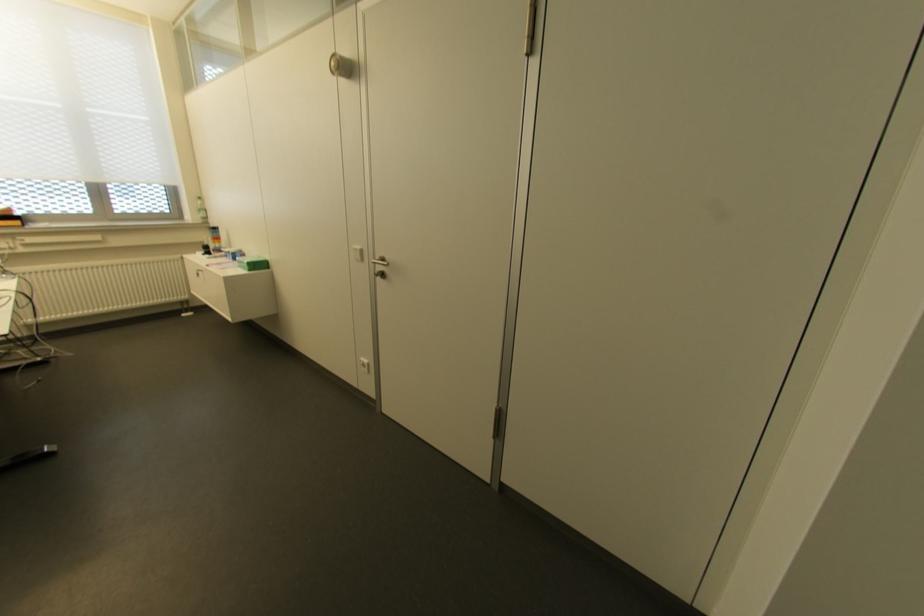
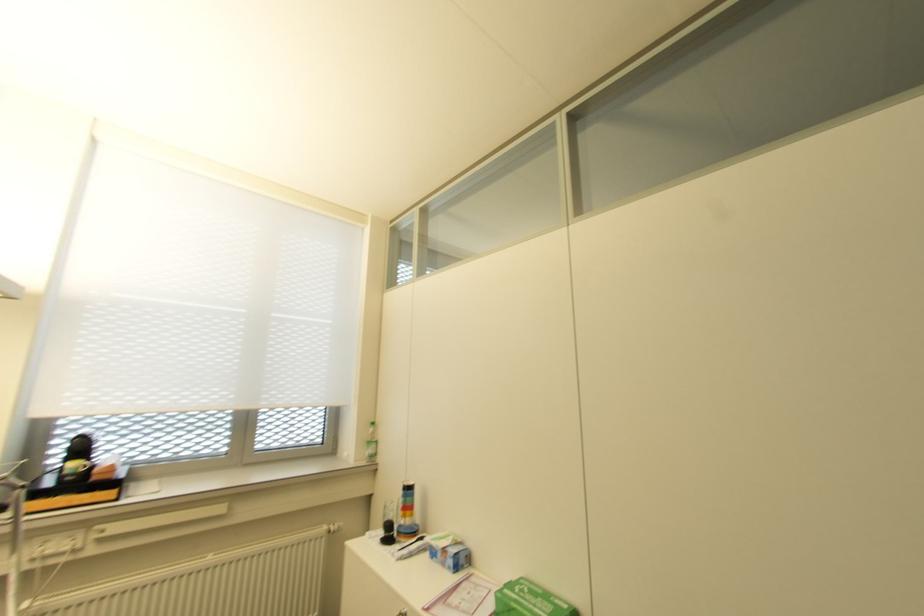
In the second image, find the point that corresponds to (226,253) in the first image.

(441, 549)